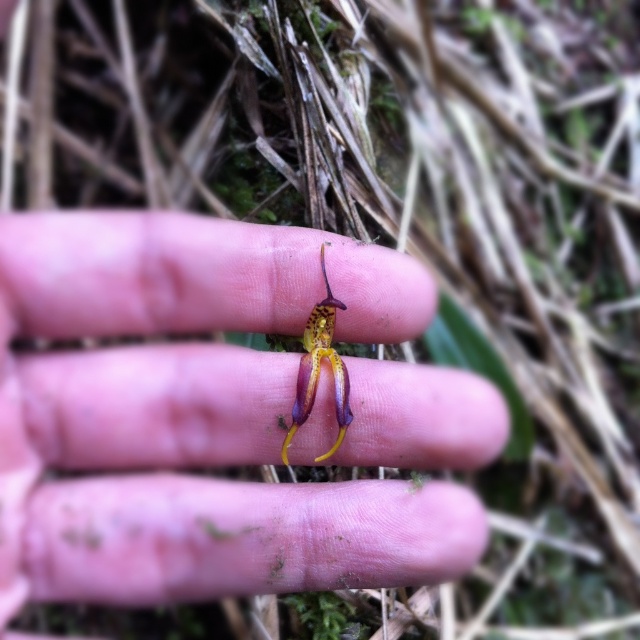
Can you confirm if matte yellow flower at center is taller than shiny yellow-green flower at center?

Yes, matte yellow flower at center is taller than shiny yellow-green flower at center.

Who is shorter, matte yellow flower at center or shiny yellow-green flower at center?

shiny yellow-green flower at center

The height and width of the screenshot is (640, 640). Find the location of `matte yellow flower at center`. matte yellow flower at center is located at coordinates (195, 416).